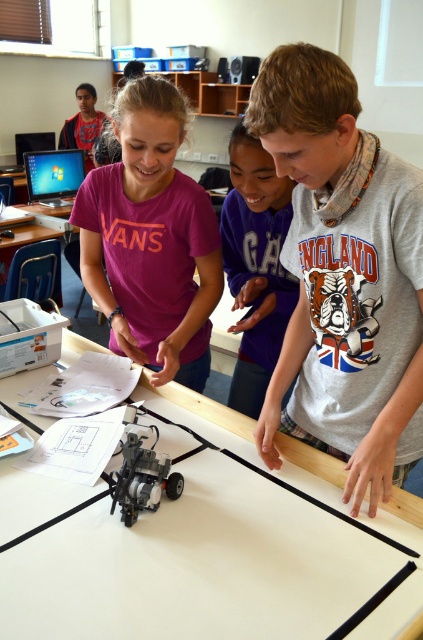
You are a teacher observing a robotics activity in a classroom. You notice the white matte table at center and the gray cotton shirt at center. Which object is taller?

The gray cotton shirt at center is taller than the white matte table at center.